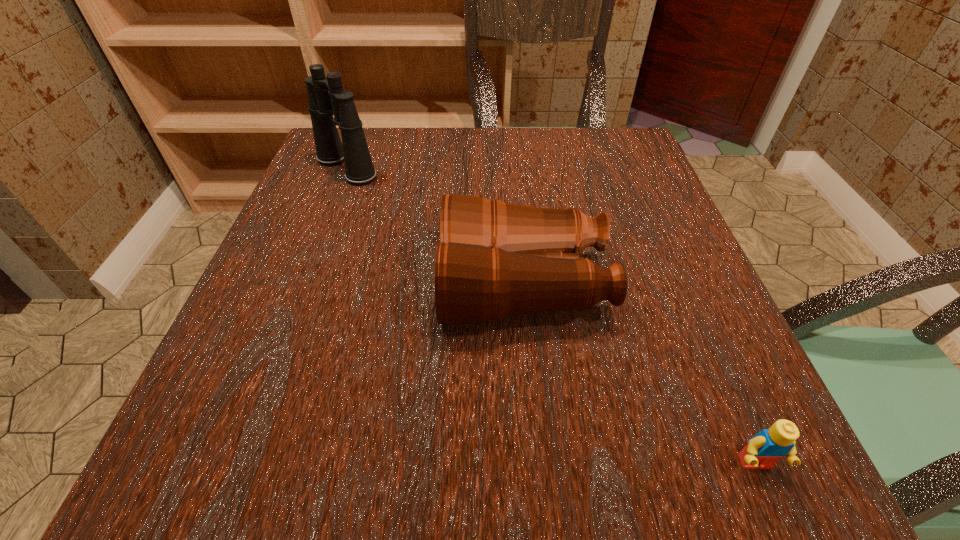
The height and width of the screenshot is (540, 960). In the image, there is a desktop. Identify the location of vacant space at the far right corner. (635, 161).

The image size is (960, 540). What are the coordinates of `free space at the near right corner of the desktop` in the screenshot? It's located at (678, 446).

The image size is (960, 540). In order to click on vacant space that's between the Lego and the second shortest object in this screenshot , I will do click(639, 374).

Where is `vacant area that lies between the tallest object and the Lego`? vacant area that lies between the tallest object and the Lego is located at coordinates (551, 316).

In order to click on vacant point located between the leftmost object and the nearer binoculars in this screenshot , I will do `click(435, 226)`.

Where is `vacant area that lies between the Lego and the second nearest object`? The height and width of the screenshot is (540, 960). vacant area that lies between the Lego and the second nearest object is located at coordinates (639, 374).

Identify the location of free area in between the second shortest object and the shortest object. (639, 374).

Locate an element on the screen. The image size is (960, 540). vacant area between the Lego and the farther binoculars is located at coordinates (551, 316).

You are a GUI agent. You are given a task and a screenshot of the screen. Output one action in this format:
    pyautogui.click(x=<x>, y=<y>)
    Task: Click on the free space between the rightmost object and the second shortest object
    
    Given the screenshot: What is the action you would take?
    pyautogui.click(x=639, y=374)

Identify the location of free space between the tallest object and the second shortest object. (435, 226).